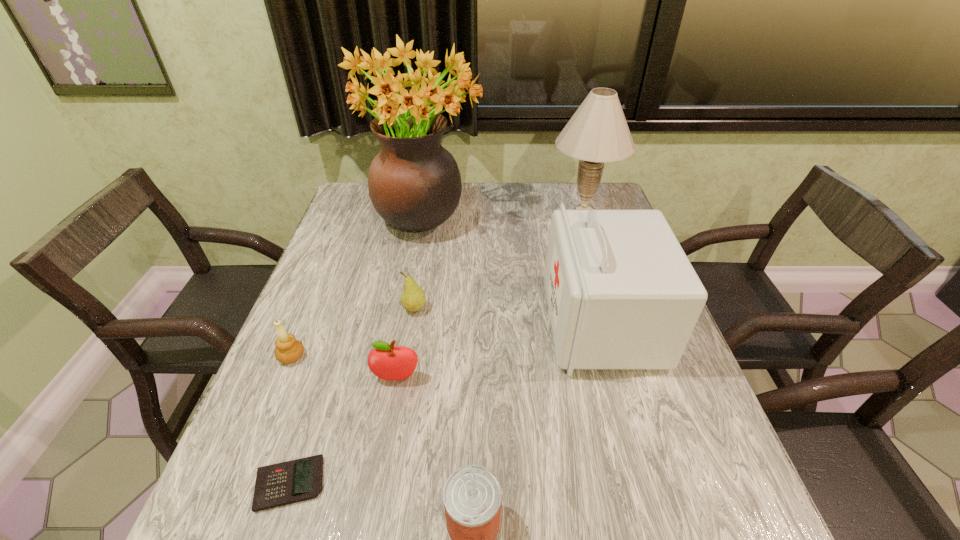
Find the location of a particular element. vacant point located 0.290m on the front-facing side of the first-aid kit is located at coordinates (428, 323).

I want to click on vacant space situated on the front-facing side of the first-aid kit, so click(x=453, y=323).

You are a GUI agent. You are given a task and a screenshot of the screen. Output one action in this format:
    pyautogui.click(x=<x>, y=<y>)
    Task: Click on the vacant area situated on the front of the pear
    The image size is (960, 540).
    Given the screenshot: What is the action you would take?
    pyautogui.click(x=399, y=408)

Identify the location of free space located 0.290m on the back of the apple. Image resolution: width=960 pixels, height=540 pixels. (413, 281).

You are a GUI agent. You are given a task and a screenshot of the screen. Output one action in this format:
    pyautogui.click(x=<x>, y=<y>)
    Task: Click on the vacant region located on the back of the candle_holder
    The image size is (960, 540).
    Given the screenshot: What is the action you would take?
    pyautogui.click(x=310, y=310)

You are a GUI agent. You are given a task and a screenshot of the screen. Output one action in this format:
    pyautogui.click(x=<x>, y=<y>)
    Task: Click on the free location located on the back of the shortest object
    The image size is (960, 540).
    Given the screenshot: What is the action you would take?
    pyautogui.click(x=315, y=404)

Locate an element on the screen. The width and height of the screenshot is (960, 540). flower arrangement situated at the far edge is located at coordinates (414, 183).

At what (x,y) coordinates should I click in order to perform the action: click on lampshade at the far edge. Please return your answer as a coordinate pair (x, y). This screenshot has height=540, width=960. Looking at the image, I should click on coord(598,132).

Where is `object at the near edge`? The height and width of the screenshot is (540, 960). object at the near edge is located at coordinates (280, 484).

What are the coordinates of `flower arrangement located at the left edge` in the screenshot? It's located at pyautogui.click(x=414, y=183).